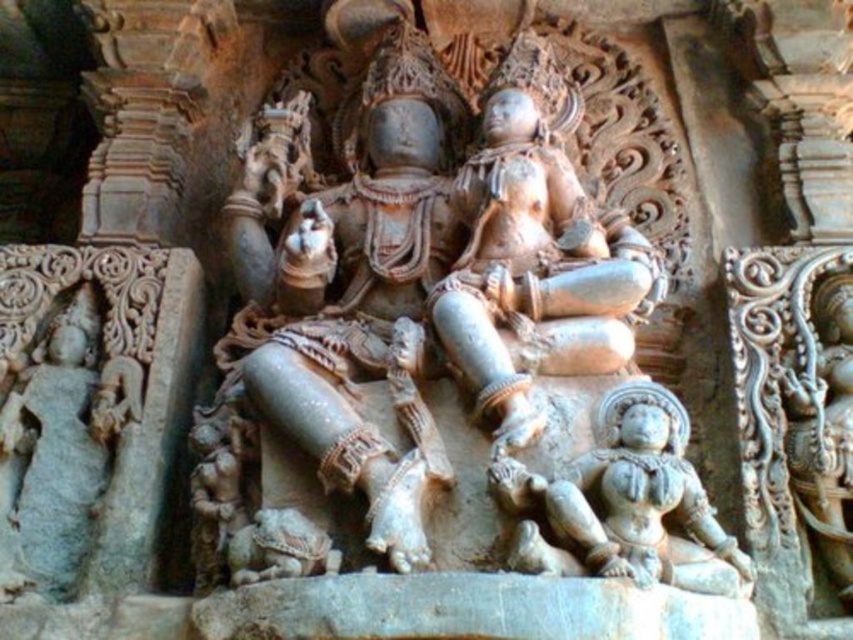
Measure the distance between gray stone statue at center and gray stone statue at left.

They are 2.94 meters apart.

Which is in front, point (265, 260) or point (18, 524)?

Point (18, 524)

Locate an element on the screen. gray stone statue at center is located at coordinates (347, 285).

The image size is (853, 640). I want to click on gray stone statue at center, so click(347, 285).

Is point (601, 268) farther from viewer compared to point (51, 593)?

Yes, point (601, 268) is farther from viewer.

Which is behind, point (531, 417) or point (73, 342)?

The point (73, 342) is more distant.

The image size is (853, 640). I want to click on smooth stone statue at center, so click(x=537, y=252).

Who is more forward, (x=384, y=76) or (x=547, y=132)?

Point (x=547, y=132) is in front.

Who is more distant from viewer, (393, 468) or (643, 294)?

Positioned behind is point (643, 294).

Find the location of a particular element. The width and height of the screenshot is (853, 640). gray stone statue at center is located at coordinates click(x=347, y=285).